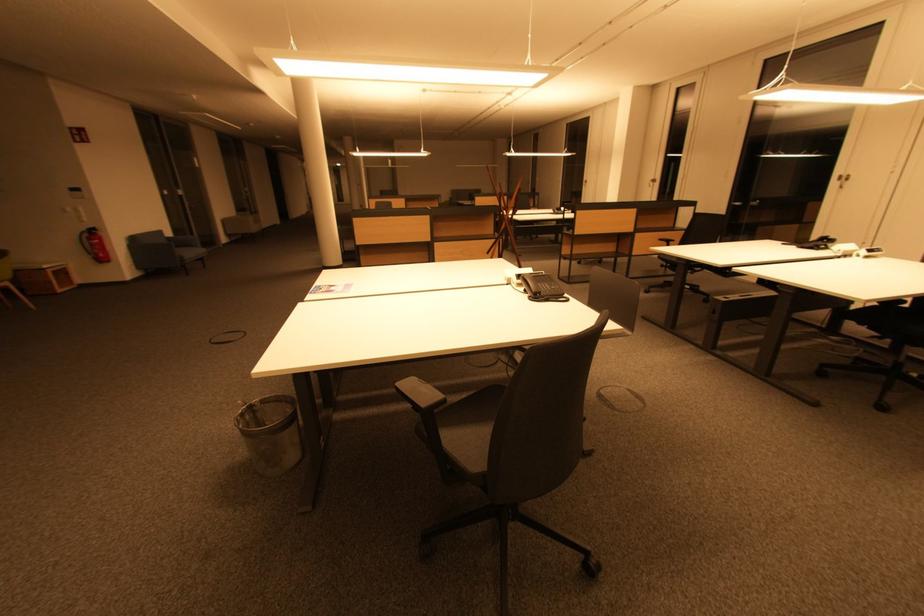
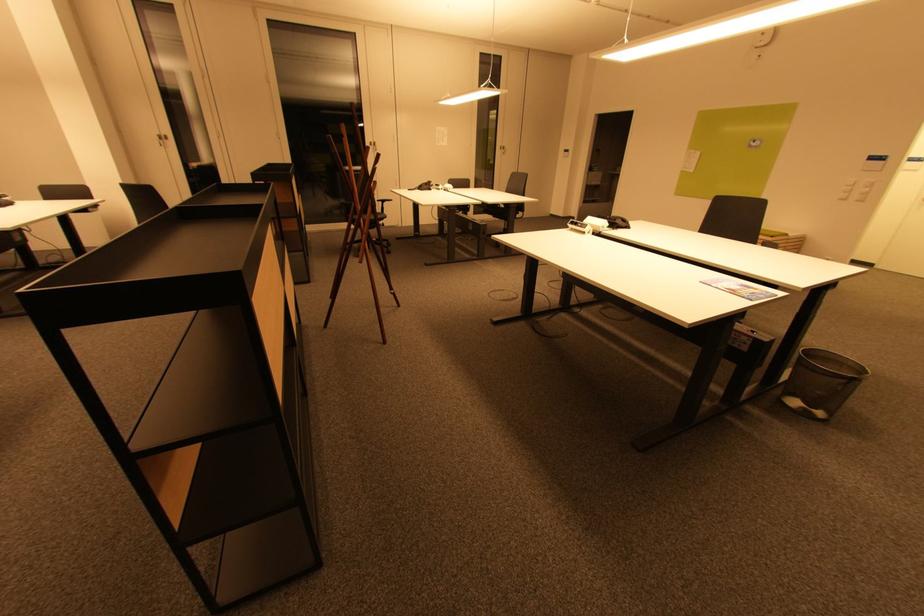
Where in the second image is the point corresponding to the point at 659,183 from the first image?

(166, 140)